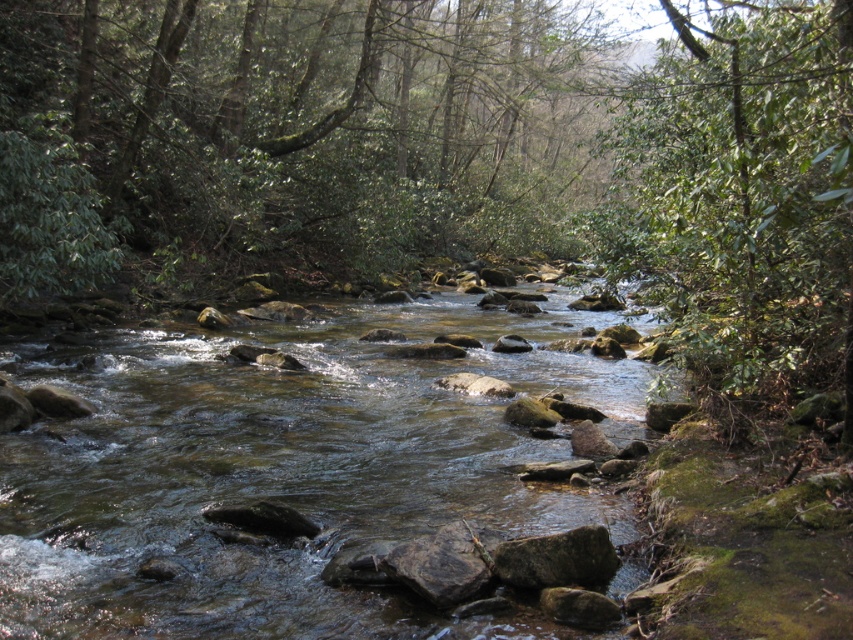
Question: Which point is closer to the camera?

Choices:
 (A) green leafy tree at upper center
 (B) clear water at center

Answer: (B)

Question: Estimate the real-world distances between objects in this image. Which object is closer to the green leafy tree at upper right?

Choices:
 (A) green leafy tree at upper center
 (B) clear water at center

Answer: (B)

Question: Is green leafy tree at upper center further to the viewer compared to green leafy tree at upper right?

Choices:
 (A) yes
 (B) no

Answer: (A)

Question: Which point is closer to the camera?

Choices:
 (A) green leafy tree at upper right
 (B) green leafy tree at upper center

Answer: (A)

Question: Is green leafy tree at upper center above green leafy tree at upper right?

Choices:
 (A) yes
 (B) no

Answer: (A)

Question: Does clear water at center appear on the right side of green leafy tree at upper right?

Choices:
 (A) yes
 (B) no

Answer: (B)